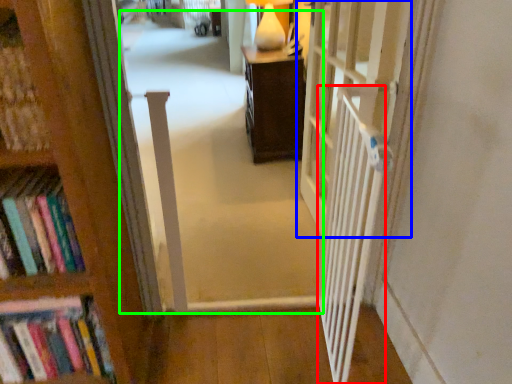
Question: Which object is the farthest from balustrade (highlighted by a red box)? Choose among these: door (highlighted by a blue box) or corridor (highlighted by a green box).

Choices:
 (A) door
 (B) corridor

Answer: (B)